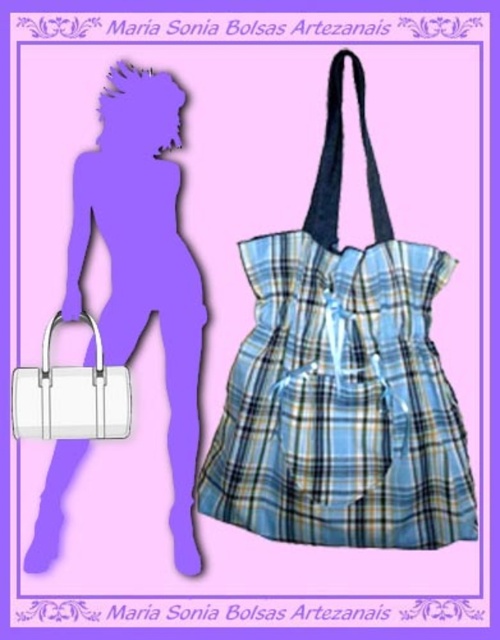
Is point (179, 106) farther from camera compared to point (96, 385)?

Yes, it is behind point (96, 385).

At what (x,y) coordinates should I click in order to perform the action: click on matte white bag at lower left. Please return your answer as a coordinate pair (x, y). The image size is (500, 640). Looking at the image, I should click on (145, 260).

Who is shorter, blue plaid fabric dress at center or white leather handbag at left?

With less height is white leather handbag at left.

Is point (311, 218) less distant than point (39, 410)?

Yes, point (311, 218) is in front of point (39, 410).

Between point (288, 538) and point (121, 372), which one is positioned behind?

Positioned behind is point (121, 372).

Locate an element on the screen. The height and width of the screenshot is (640, 500). blue plaid fabric dress at center is located at coordinates (341, 381).

Is point (384, 538) farther from camera compared to point (157, 168)?

No, it is in front of (157, 168).

The width and height of the screenshot is (500, 640). What do you see at coordinates (341, 381) in the screenshot?
I see `blue plaid fabric dress at center` at bounding box center [341, 381].

Who is more forward, (211, 506) or (25, 564)?

Point (211, 506) is in front.

Where is `blue plaid fabric dress at center`? The height and width of the screenshot is (640, 500). blue plaid fabric dress at center is located at coordinates (341, 381).